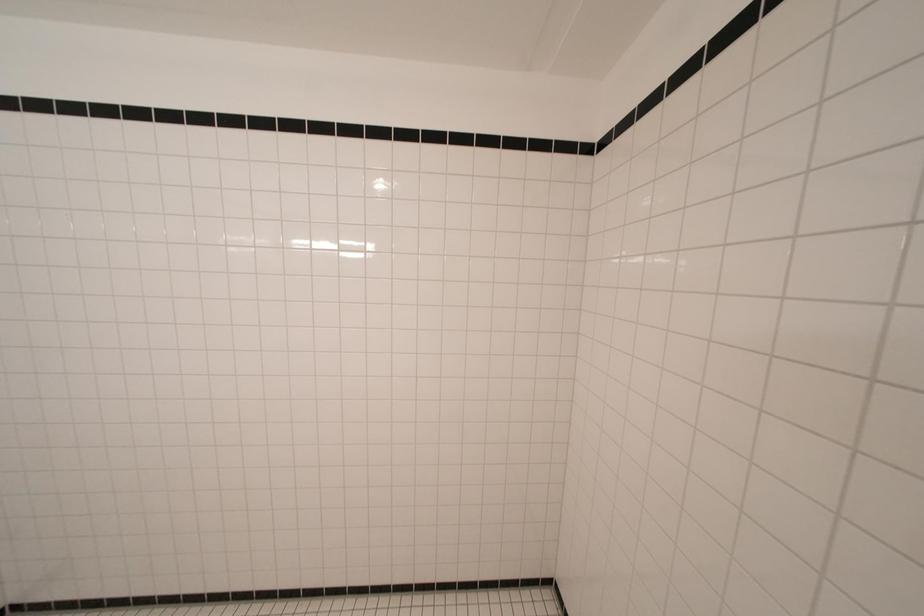
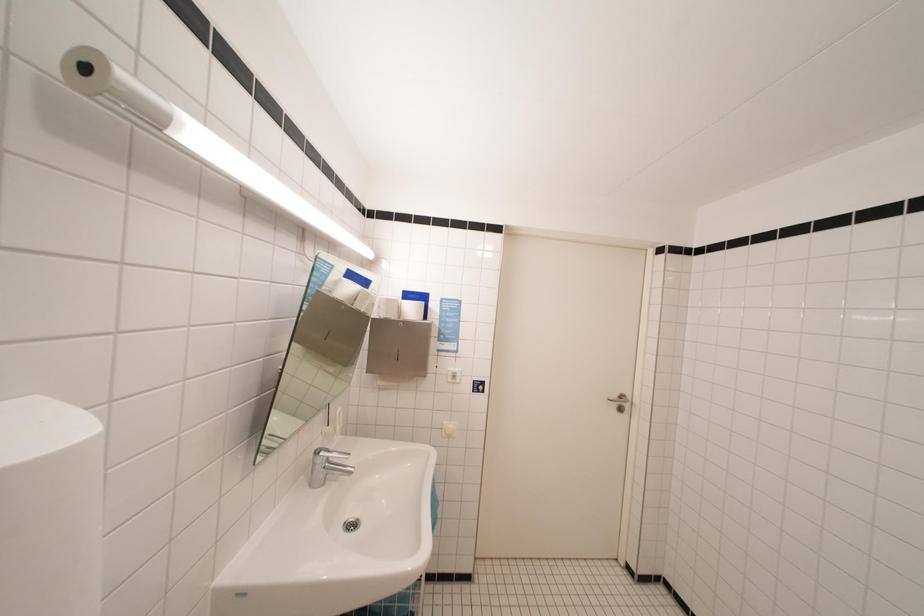
Question: The camera is either moving clockwise (left) or counter-clockwise (right) around the object. The first image is from the beginning of the video and the second image is from the end. Is the camera moving left or right when shooting the video?

Choices:
 (A) Left
 (B) Right

Answer: (B)